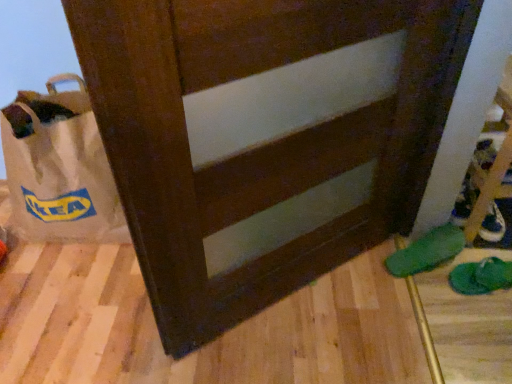
Locate an element on the screen. vacant region in front of white paper bag at left is located at coordinates (71, 304).